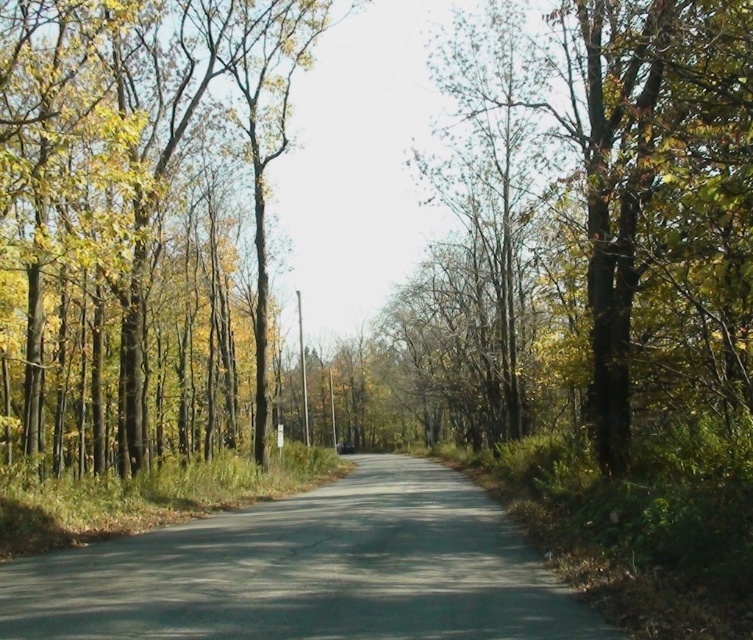
Question: Can you confirm if yellow-green leaves at left is positioned below green matte tree at right?

Choices:
 (A) no
 (B) yes

Answer: (B)

Question: Is green matte tree at right further to camera compared to gray asphalt road at center?

Choices:
 (A) no
 (B) yes

Answer: (B)

Question: Which object is positioned closest to the yellow-green leaves at left?

Choices:
 (A) green matte tree at right
 (B) gray asphalt road at center

Answer: (B)

Question: Is yellow-green leaves at left to the right of green matte tree at right from the viewer's perspective?

Choices:
 (A) yes
 (B) no

Answer: (B)

Question: Which point is farther to the camera?

Choices:
 (A) gray asphalt road at center
 (B) green matte tree at right

Answer: (B)

Question: Which of these objects is positioned farthest from the yellow-green leaves at left?

Choices:
 (A) gray asphalt road at center
 (B) green matte tree at right

Answer: (B)